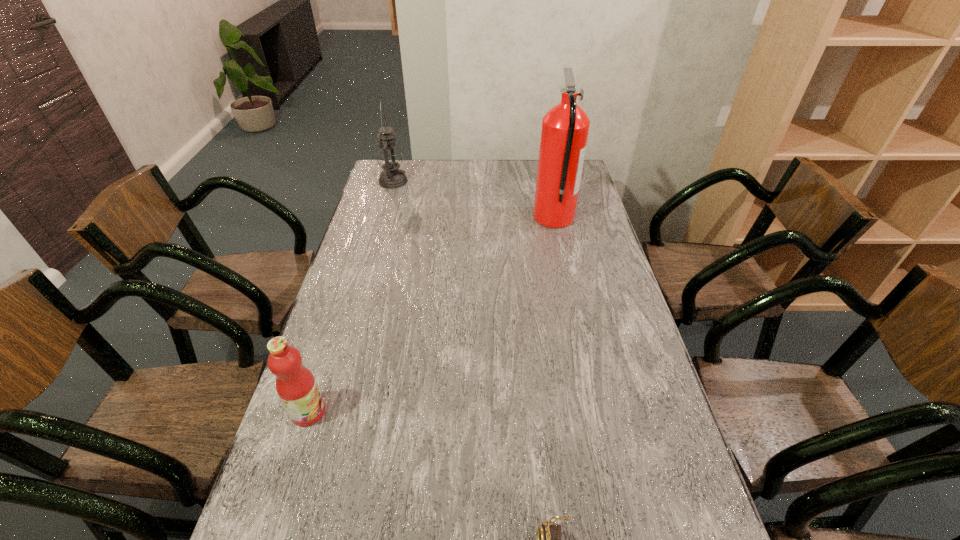
This screenshot has height=540, width=960. In order to click on free space located on the front label of the fruit juice in this screenshot , I will do `click(374, 412)`.

Identify the location of object at the far edge. The height and width of the screenshot is (540, 960). (389, 157).

Identify the location of oil lamp located in the left edge section of the desktop. click(389, 157).

Find the location of a particular element. This screenshot has width=960, height=540. fruit juice situated at the left edge is located at coordinates (296, 386).

Identify the location of object situated at the right edge. Image resolution: width=960 pixels, height=540 pixels. (565, 127).

This screenshot has height=540, width=960. Find the location of `object that is positioned at the far left corner`. object that is positioned at the far left corner is located at coordinates (389, 157).

Where is `vacant region at the left edge of the desktop`? vacant region at the left edge of the desktop is located at coordinates (371, 284).

Identify the location of vacant space at the right edge. (605, 268).

I want to click on empty space between the oil lamp and the third nearest object, so click(x=473, y=200).

In order to click on vacant area that lies between the second tallest object and the second nearest object in this screenshot , I will do `click(350, 297)`.